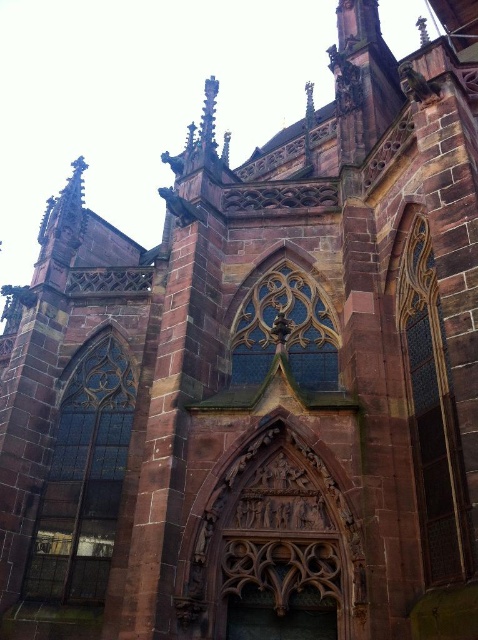
Does stained glass window at left appear on the right side of translucent stained glass at center?

No, stained glass window at left is not to the right of translucent stained glass at center.

Is the position of stained glass window at left more distant than that of translucent stained glass at center?

That is True.

I want to click on stained glass window at left, so click(x=84, y=481).

Does stained glass window at left have a greater height compared to dark stained glass window at right?

No.

Does stained glass window at left have a lesser width compared to dark stained glass window at right?

No, stained glass window at left is not thinner than dark stained glass window at right.

Is point (76, 401) in front of point (421, 232)?

No, (76, 401) is further to viewer.

Where is `stained glass window at left`? stained glass window at left is located at coordinates (84, 481).

In the scene shown: Who is positioned more to the right, dark stained glass window at right or translucent stained glass at center?

From the viewer's perspective, dark stained glass window at right appears more on the right side.

Between dark stained glass window at right and translucent stained glass at center, which one is positioned lower?

Positioned lower is dark stained glass window at right.

Who is more forward, [406,349] or [256,307]?

Point [406,349]

Identify the location of dark stained glass window at right. (433, 417).